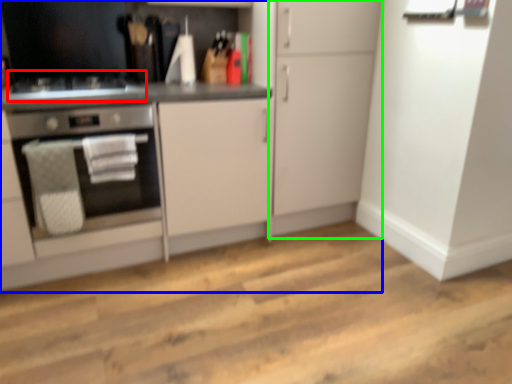
Question: Which is farther away from gas stove (highlighted by a red box)? cabinetry (highlighted by a blue box) or cabinetry (highlighted by a green box)?

Choices:
 (A) cabinetry
 (B) cabinetry

Answer: (B)